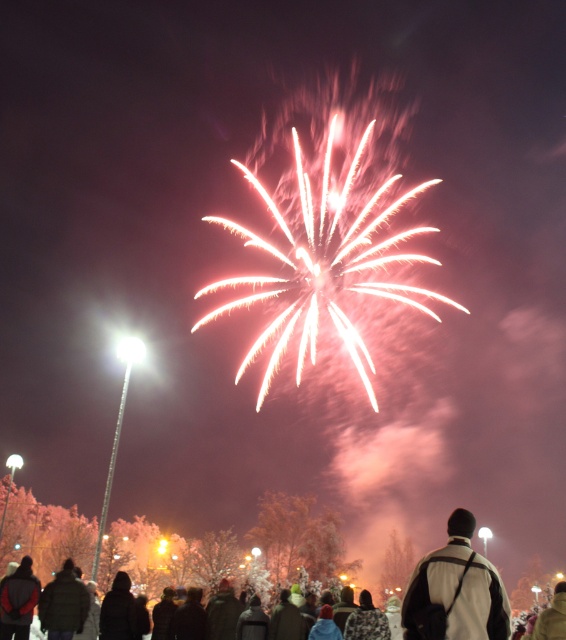
Question: Does white matte jacket at center appear under dark brown leather jacket at lower left?

Choices:
 (A) yes
 (B) no

Answer: (B)

Question: Which point is farther from the camera taking this photo?

Choices:
 (A) (409, 618)
 (B) (6, 628)

Answer: (B)

Question: Is white matte jacket at center thinner than dark brown leather jacket at lower left?

Choices:
 (A) no
 (B) yes

Answer: (B)

Question: In this image, where is white matte jacket at center located relative to dark brown leather jacket at lower left?

Choices:
 (A) right
 (B) left

Answer: (A)

Question: Among these objects, which one is nearest to the camera?

Choices:
 (A) dark brown leather jacket at lower left
 (B) white matte jacket at center

Answer: (B)